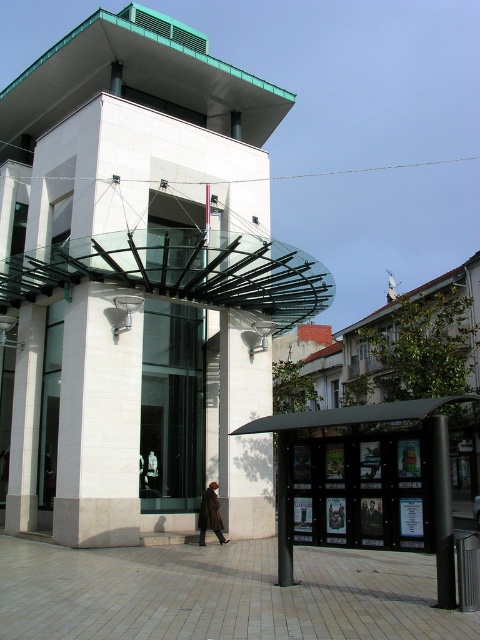
Is white marble pillar at center in front of white concrete pillar at center?

Yes, it is.

In order to click on white marble pillar at center in this screenshot , I will do tap(97, 422).

Who is more forward, [80,417] or [252,385]?

Point [80,417]

Find the location of `white marble pillar at center`. white marble pillar at center is located at coordinates (97, 422).

Can you confirm if white concrete pillar at center is smaller than brown leather coat at center?

Yes, white concrete pillar at center is smaller than brown leather coat at center.

Does point (245, 536) lie behind point (214, 518)?

That is True.

Who is more distant from viewer, (241,497) or (203,497)?

The point (241,497) is behind.

You are a GUI agent. You are given a task and a screenshot of the screen. Output one action in this format:
    pyautogui.click(x=<x>, y=<y>)
    Task: Click on the white concrete pillar at center
    
    Given the screenshot: What is the action you would take?
    pyautogui.click(x=244, y=422)

From the picture: Is white marble pillar at center wider than white polished stone pillar at left?

No.

Who is taller, white marble pillar at center or white polished stone pillar at left?

white marble pillar at center

Which is behind, point (135, 387) or point (12, 436)?

The point (12, 436) is more distant.

Find the location of a particular element. white marble pillar at center is located at coordinates (x=97, y=422).